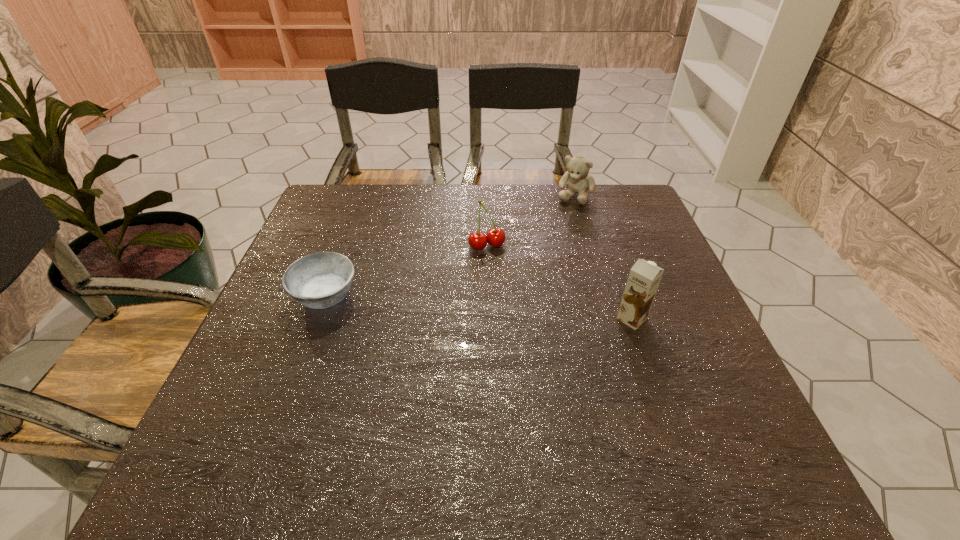
Identify the location of the shortest object. The width and height of the screenshot is (960, 540). (320, 280).

Find the location of a particular element. the leftmost object is located at coordinates (320, 280).

The image size is (960, 540). What are the coordinates of `chocolate milk` in the screenshot? It's located at (644, 277).

This screenshot has width=960, height=540. I want to click on cherry, so click(x=495, y=237).

Find the location of a particular element. the second object from left to right is located at coordinates (495, 237).

The image size is (960, 540). Find the location of `the farthest object`. the farthest object is located at coordinates (578, 181).

You are a GUI agent. You are given a task and a screenshot of the screen. Output one action in this format:
    pyautogui.click(x=<x>, y=<y>)
    Task: Click on the free space located 0.210m on the back of the leftmost object
    The image size is (960, 540).
    Given the screenshot: What is the action you would take?
    pos(352,224)

This screenshot has width=960, height=540. Find the location of `free point located on the right of the chocolate milk`. free point located on the right of the chocolate milk is located at coordinates (697, 319).

The height and width of the screenshot is (540, 960). Find the location of `free spot located with the stems of the cherry pointing upwards`. free spot located with the stems of the cherry pointing upwards is located at coordinates (500, 268).

Identify the location of vacant region located with the stems of the cherry pointing upwards. (541, 349).